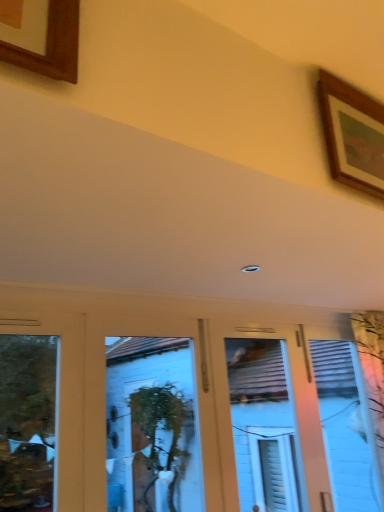
Question: Considering the relative positions of white glossy door at center and wooden picture frame at upper right in the image provided, is white glossy door at center to the left or to the right of wooden picture frame at upper right?

Choices:
 (A) right
 (B) left

Answer: (B)

Question: Is white glossy door at center taller or shorter than wooden picture frame at upper right?

Choices:
 (A) tall
 (B) short

Answer: (A)

Question: From a real-world perspective, is white glossy door at center positioned above or below wooden picture frame at upper right?

Choices:
 (A) below
 (B) above

Answer: (A)

Question: Relative to white glossy door at center, is wooden picture frame at upper right in front or behind?

Choices:
 (A) front
 (B) behind

Answer: (A)

Question: From a real-world perspective, is wooden picture frame at upper right positioned above or below white glossy door at center?

Choices:
 (A) below
 (B) above

Answer: (B)

Question: From the image's perspective, is wooden picture frame at upper right above or below white glossy door at center?

Choices:
 (A) below
 (B) above

Answer: (B)

Question: In terms of width, does wooden picture frame at upper right look wider or thinner when compared to white glossy door at center?

Choices:
 (A) thin
 (B) wide

Answer: (A)